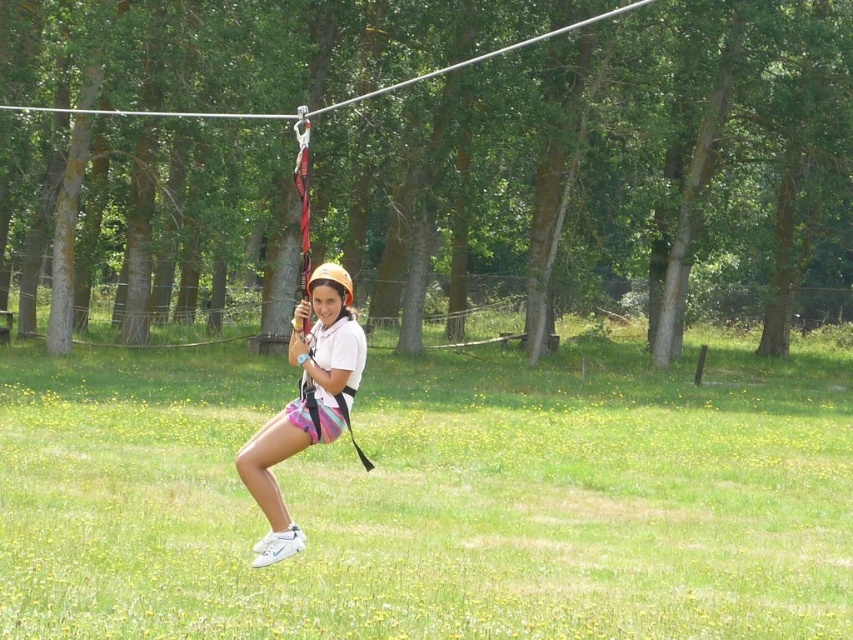
Question: Can you confirm if green grassy field at center is positioned to the left of white matte helmet at center?

Choices:
 (A) yes
 (B) no

Answer: (B)

Question: Estimate the real-world distances between objects in this image. Which object is farther from the green grassy field at center?

Choices:
 (A) white matte helmet at center
 (B) brown wood tree at center

Answer: (A)

Question: Among these objects, which one is farthest from the camera?

Choices:
 (A) white matte helmet at center
 (B) green grassy field at center

Answer: (A)

Question: Is green grassy field at center wider than white matte helmet at center?

Choices:
 (A) yes
 (B) no

Answer: (A)

Question: Among these objects, which one is nearest to the camera?

Choices:
 (A) green grassy field at center
 (B) brown wood tree at center

Answer: (A)

Question: Is brown wood tree at center below green grassy field at center?

Choices:
 (A) no
 (B) yes

Answer: (A)